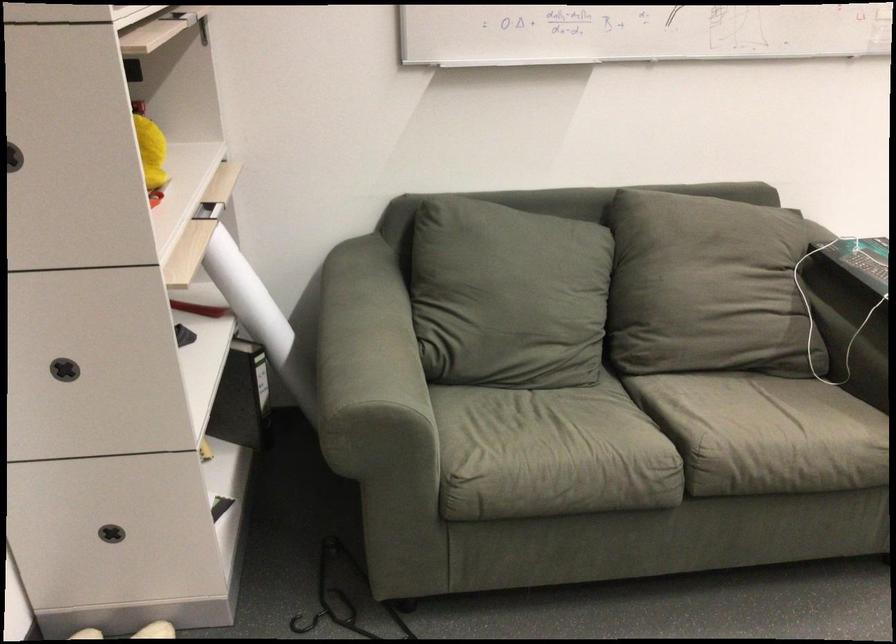
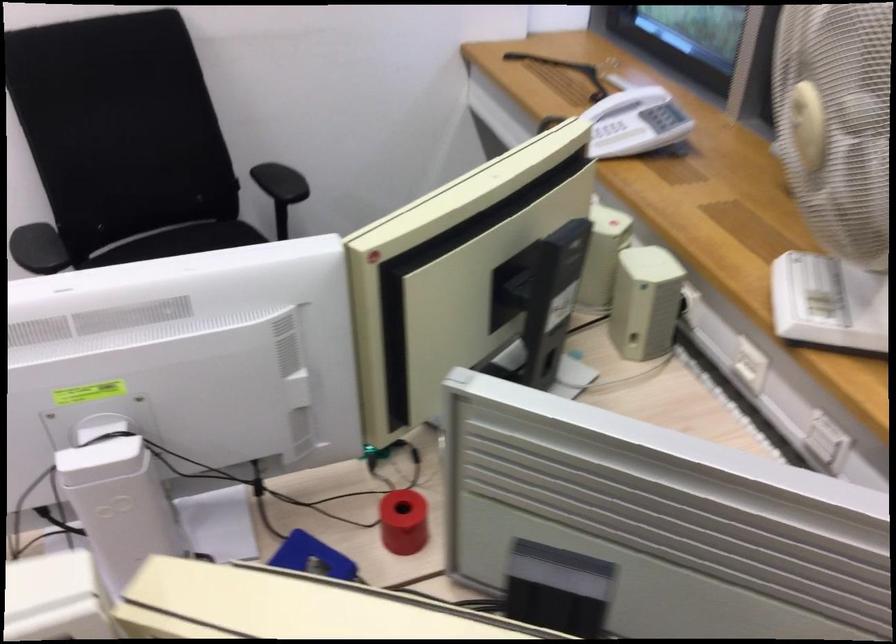
Question: Which direction would the cameraman need to move to produce the second image? Reply with the corresponding letter.

Choices:
 (A) Left
 (B) Right
 (C) Forward
 (D) Backward

Answer: (B)